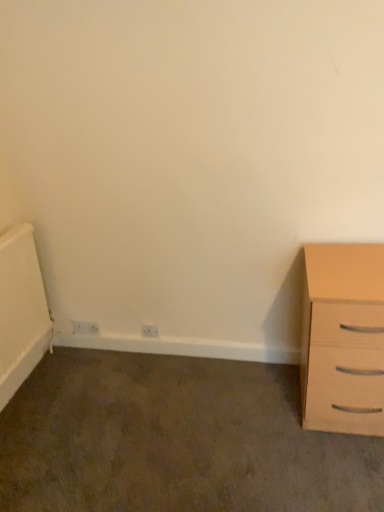
Question: Considering the positions of white plastic electric outlet at lower center, which is counted as the 2th electric outlet, starting from the left, and white plastic electric outlet at lower left, which is the first electric outlet in back-to-front order, in the image, is white plastic electric outlet at lower center, which is counted as the 2th electric outlet, starting from the left, wider or thinner than white plastic electric outlet at lower left, which is the first electric outlet in back-to-front order,?

Choices:
 (A) wide
 (B) thin

Answer: (A)

Question: In the image, is white plastic electric outlet at lower center, arranged as the first electric outlet when viewed from the front, positioned in front of or behind white plastic electric outlet at lower left, which is the first electric outlet in back-to-front order?

Choices:
 (A) front
 (B) behind

Answer: (A)

Question: Estimate the real-world distances between objects in this image. Which object is farther from the white plastic electric outlet at lower center, which is counted as the first electric outlet, starting from the right?

Choices:
 (A) white plastic electric outlet at lower left, which ranks as the first electric outlet in left-to-right order
 (B) light wood chest of drawers at right

Answer: (B)

Question: Which is nearer to the white plastic electric outlet at lower left, which is the first electric outlet in back-to-front order?

Choices:
 (A) light wood chest of drawers at right
 (B) white plastic electric outlet at lower center, which is counted as the first electric outlet, starting from the right

Answer: (B)